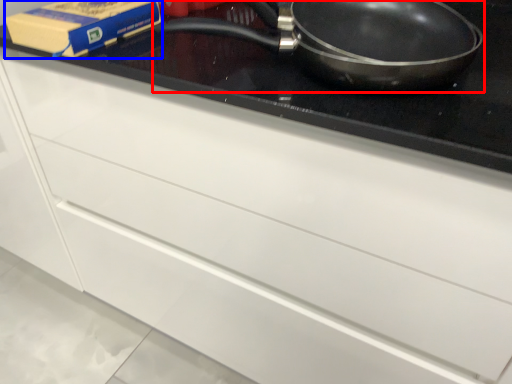
Question: Which of the following is the closest to the observer, frying pan (highlighted by a red box) or paperback book (highlighted by a blue box)?

Choices:
 (A) frying pan
 (B) paperback book

Answer: (A)